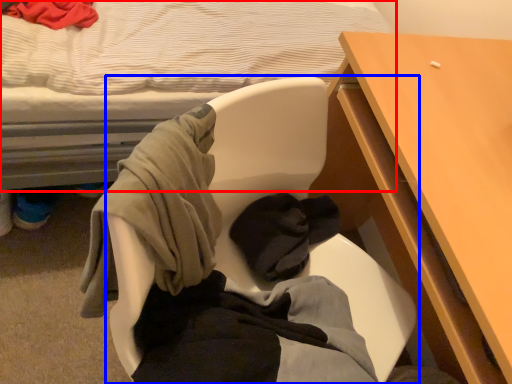
Question: Among these objects, which one is nearest to the camera, bed (highlighted by a red box) or chair (highlighted by a blue box)?

Choices:
 (A) bed
 (B) chair

Answer: (A)